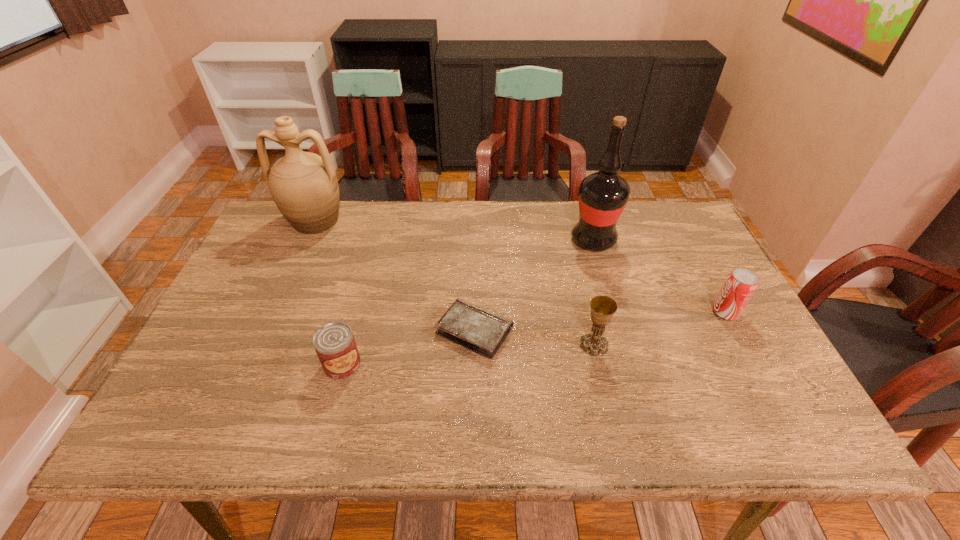
Find the location of a particular element. The image size is (960, 540). free space located 0.330m on the right of the chalice is located at coordinates (745, 345).

Locate an element on the screen. free spot located 0.360m on the logo side of the rightmost object is located at coordinates (574, 312).

Find the location of a particular element. vacant point located on the logo side of the rightmost object is located at coordinates (570, 312).

Identify the location of free space located 0.110m on the logo side of the rightmost object. This screenshot has width=960, height=540. (670, 312).

The height and width of the screenshot is (540, 960). Identify the location of free location located 0.290m on the left of the fifth tallest object. point(200,364).

Identify the location of vacant space located 0.080m on the front of the diary. The width and height of the screenshot is (960, 540). (473, 390).

Locate an element on the screen. The height and width of the screenshot is (540, 960). wine bottle present at the far edge is located at coordinates (602, 196).

At what (x,y) coordinates should I click in order to perform the action: click on pitcher that is positioned at the far edge. Please return your answer as a coordinate pair (x, y). The width and height of the screenshot is (960, 540). Looking at the image, I should click on (303, 185).

Locate an element on the screen. Image resolution: width=960 pixels, height=540 pixels. object present at the left edge is located at coordinates (303, 185).

Where is `object present at the right edge`? This screenshot has height=540, width=960. object present at the right edge is located at coordinates (739, 286).